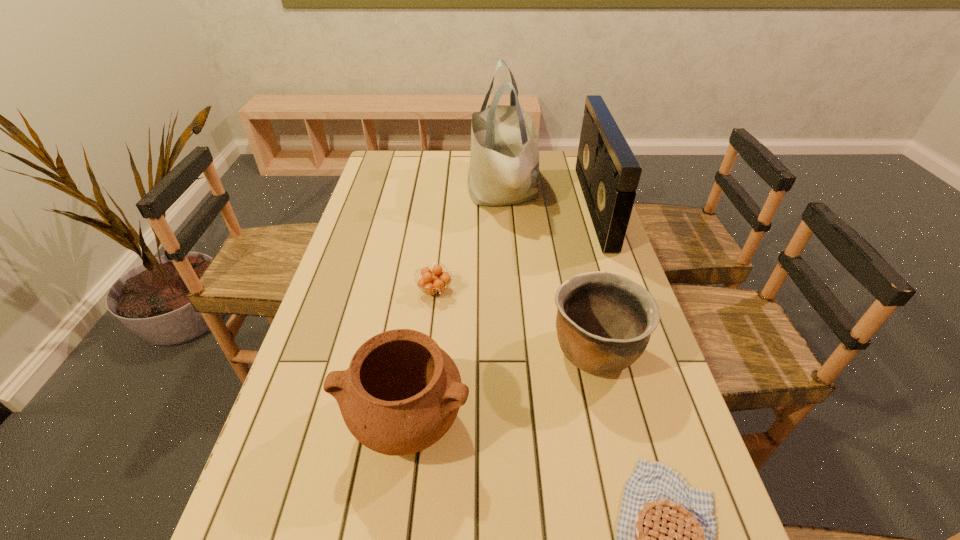
You are a GUI agent. You are given a task and a screenshot of the screen. Output one action in this format:
    pyautogui.click(x=<x>, y=<y>)
    Task: Click on the shopping bag
    Image resolution: width=960 pixels, height=540 pixels.
    Given the screenshot: What is the action you would take?
    pyautogui.click(x=504, y=158)

Identify the location of videotape. (608, 172).

What are the coordinates of `the left pottery` in the screenshot? It's located at (401, 393).

Locate an element on the screen. The image size is (960, 540). the fourth tallest object is located at coordinates (604, 321).

Where is `the right pottery`? The height and width of the screenshot is (540, 960). the right pottery is located at coordinates (604, 321).

This screenshot has height=540, width=960. Find the location of `the fifth tallest object`. the fifth tallest object is located at coordinates (430, 281).

Locate an element on the screen. orange fruit is located at coordinates (430, 281).

Locate an element on the screen. This screenshot has width=960, height=540. vacant space located 0.200m on the right of the shopping bag is located at coordinates (591, 188).

The width and height of the screenshot is (960, 540). Find the location of `vacant area situated on the front side of the fifth shortest object`. vacant area situated on the front side of the fifth shortest object is located at coordinates (506, 207).

Identify the location of vacant space located on the front side of the fifth shortest object. The image size is (960, 540). (470, 207).